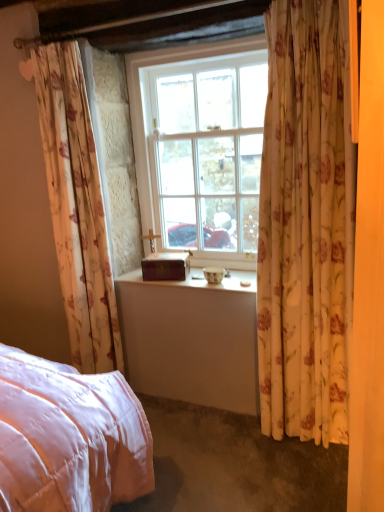
You are a GUI agent. You are given a task and a screenshot of the screen. Output one action in this format:
    pyautogui.click(x=<x>, y=<y>)
    Task: Click on the floral fabric curtain at left, marked as the first curtain in a left-to-right arrangement
    The height and width of the screenshot is (512, 384).
    Given the screenshot: What is the action you would take?
    pyautogui.click(x=77, y=208)

Locate an element on the screen. This screenshot has height=512, width=384. white glass window at center is located at coordinates (201, 146).

This screenshot has width=384, height=512. I want to click on floral fabric curtain at right, the 1th curtain from the right, so click(x=306, y=224).

The image size is (384, 512). Describe the element at coordinates (306, 224) in the screenshot. I see `floral fabric curtain at right, the 1th curtain from the right` at that location.

The image size is (384, 512). Identify the location of wooden box at center. (166, 266).

In order to click on floral fabric curtain at left, the 2th curtain from the right in this screenshot , I will do `click(77, 208)`.

From the picture: From the image's perspective, which one is positioned higher, wooden box at center or white glass window at center?

From the image's view, white glass window at center is above.

Could you tell me if wooden box at center is turned towards white glass window at center?

No, wooden box at center is not aimed at white glass window at center.

Considering the sizes of objects wooden box at center and white glass window at center in the image provided, who is shorter, wooden box at center or white glass window at center?

wooden box at center.

Considering the relative positions of wooden box at center and white glass window at center in the image provided, is wooden box at center to the left or to the right of white glass window at center?

In the image, wooden box at center appears on the left side of white glass window at center.

From a real-world perspective, which object rests below the other?

From a 3D spatial view, wooden box at center is below.

From the image's perspective, which is below, wooden box at center or floral fabric curtain at right, marked as the 2th curtain in a left-to-right arrangement?

wooden box at center.

Would you consider wooden box at center to be distant from floral fabric curtain at right, the 1th curtain from the right?

They are positioned close to each other.

Is floral fabric curtain at right, marked as the 2th curtain in a left-to-right arrangement, in contact with white glass window at center?

floral fabric curtain at right, marked as the 2th curtain in a left-to-right arrangement, and white glass window at center are clearly separated.

Is point (276, 393) closer to viewer compared to point (194, 233)?

That is True.

Would you say floral fabric curtain at right, the 1th curtain from the right, is to the left or to the right of white glass window at center in the picture?

In the image, floral fabric curtain at right, the 1th curtain from the right, appears on the right side of white glass window at center.

From the image's perspective, between floral fabric curtain at right, the 1th curtain from the right, and white glass window at center, who is located below?

From the image's view, floral fabric curtain at right, the 1th curtain from the right, is below.

Which of these two, wooden box at center or white glass window at center, is thinner?

With smaller width is white glass window at center.

From a real-world perspective, is wooden box at center positioned under white glass window at center based on gravity?

Correct, in the physical world, wooden box at center is lower than white glass window at center.

In the image, is wooden box at center positioned in front of or behind white glass window at center?

In the image, wooden box at center appears behind white glass window at center.

This screenshot has height=512, width=384. In order to click on the 1st curtain directly above the wooden box at center (from a real-world perspective) in this screenshot , I will do `click(77, 208)`.

In the image, is wooden box at center positioned in front of or behind floral fabric curtain at left, the 2th curtain from the right?

In the image, wooden box at center appears behind floral fabric curtain at left, the 2th curtain from the right.

Looking at this image, is wooden box at center directly adjacent to floral fabric curtain at left, the 2th curtain from the right?

They are not placed beside each other.

Who is taller, wooden box at center or floral fabric curtain at left, the 2th curtain from the right?

Standing taller between the two is floral fabric curtain at left, the 2th curtain from the right.

How many degrees apart are the facing directions of white glass window at center and floral fabric curtain at right, marked as the 2th curtain in a left-to-right arrangement?

white glass window at center and floral fabric curtain at right, marked as the 2th curtain in a left-to-right arrangement, are facing 0.0332 degrees away from each other.

Could you tell me if white glass window at center is facing floral fabric curtain at right, marked as the 2th curtain in a left-to-right arrangement?

No, white glass window at center is not aimed at floral fabric curtain at right, marked as the 2th curtain in a left-to-right arrangement.

Between white glass window at center and floral fabric curtain at right, the 1th curtain from the right, which one has less height?

Standing shorter between the two is white glass window at center.

From a real-world perspective, which is physically below, floral fabric curtain at left, the 2th curtain from the right, or floral fabric curtain at right, marked as the 2th curtain in a left-to-right arrangement?

In real-world perspective, floral fabric curtain at left, the 2th curtain from the right, is lower.

Does floral fabric curtain at left, marked as the first curtain in a left-to-right arrangement, appear on the left side of floral fabric curtain at right, the 1th curtain from the right?

Yes, floral fabric curtain at left, marked as the first curtain in a left-to-right arrangement, is to the left of floral fabric curtain at right, the 1th curtain from the right.

Who is shorter, floral fabric curtain at left, the 2th curtain from the right, or floral fabric curtain at right, marked as the 2th curtain in a left-to-right arrangement?

Standing shorter between the two is floral fabric curtain at right, marked as the 2th curtain in a left-to-right arrangement.

From the image's perspective, does floral fabric curtain at left, marked as the first curtain in a left-to-right arrangement, appear higher than floral fabric curtain at right, the 1th curtain from the right?

Yes.

Locate an element on the screen. window sill below the white glass window at center (from the image's perspective) is located at coordinates (191, 281).

In the image, there is a floral fabric curtain at right, the 1th curtain from the right. Where is `window sill below it (from a real-world perspective)`? The image size is (384, 512). window sill below it (from a real-world perspective) is located at coordinates (191, 281).

Estimate the real-world distances between objects in this image. Which object is further from wooden box at center, white glass window at center or floral fabric curtain at left, marked as the first curtain in a left-to-right arrangement?

The object further to wooden box at center is white glass window at center.

Based on their spatial positions, is wooden box at center or wooden box at center closer to floral fabric curtain at left, the 2th curtain from the right?

wooden box at center is closer to floral fabric curtain at left, the 2th curtain from the right.

Estimate the real-world distances between objects in this image. Which object is closer to floral fabric curtain at left, marked as the first curtain in a left-to-right arrangement, floral fabric curtain at right, the 1th curtain from the right, or white glass window at center?

Based on the image, white glass window at center appears to be nearer to floral fabric curtain at left, marked as the first curtain in a left-to-right arrangement.

Looking at the image, which one is located further to white glass window at center, floral fabric curtain at left, marked as the first curtain in a left-to-right arrangement, or wooden box at center?

floral fabric curtain at left, marked as the first curtain in a left-to-right arrangement, lies further to white glass window at center than the other object.

From the image, which object appears to be farther from floral fabric curtain at left, the 2th curtain from the right, white glass window at center or floral fabric curtain at right, the 1th curtain from the right?

floral fabric curtain at right, the 1th curtain from the right.

Looking at the image, which one is located closer to floral fabric curtain at left, marked as the first curtain in a left-to-right arrangement, floral fabric curtain at right, the 1th curtain from the right, or wooden box at center?

wooden box at center is closer to floral fabric curtain at left, marked as the first curtain in a left-to-right arrangement.

Based on their spatial positions, is wooden box at center or floral fabric curtain at left, the 2th curtain from the right, closer to white glass window at center?

The object closer to white glass window at center is floral fabric curtain at left, the 2th curtain from the right.

Estimate the real-world distances between objects in this image. Which object is closer to floral fabric curtain at left, the 2th curtain from the right, wooden box at center or wooden box at center?

wooden box at center lies closer to floral fabric curtain at left, the 2th curtain from the right, than the other object.

Where is `window situated between floral fabric curtain at left, the 2th curtain from the right, and floral fabric curtain at right, marked as the 2th curtain in a left-to-right arrangement, from left to right`? The height and width of the screenshot is (512, 384). window situated between floral fabric curtain at left, the 2th curtain from the right, and floral fabric curtain at right, marked as the 2th curtain in a left-to-right arrangement, from left to right is located at coordinates (201, 146).

Locate an element on the screen. Image resolution: width=384 pixels, height=512 pixels. box between white glass window at center and wooden box at center vertically is located at coordinates (166, 266).

Where is `box between floral fabric curtain at left, the 2th curtain from the right, and white glass window at center`? The width and height of the screenshot is (384, 512). box between floral fabric curtain at left, the 2th curtain from the right, and white glass window at center is located at coordinates (166, 266).

This screenshot has height=512, width=384. Identify the location of box located between floral fabric curtain at left, the 2th curtain from the right, and wooden box at center in the left-right direction. (166, 266).